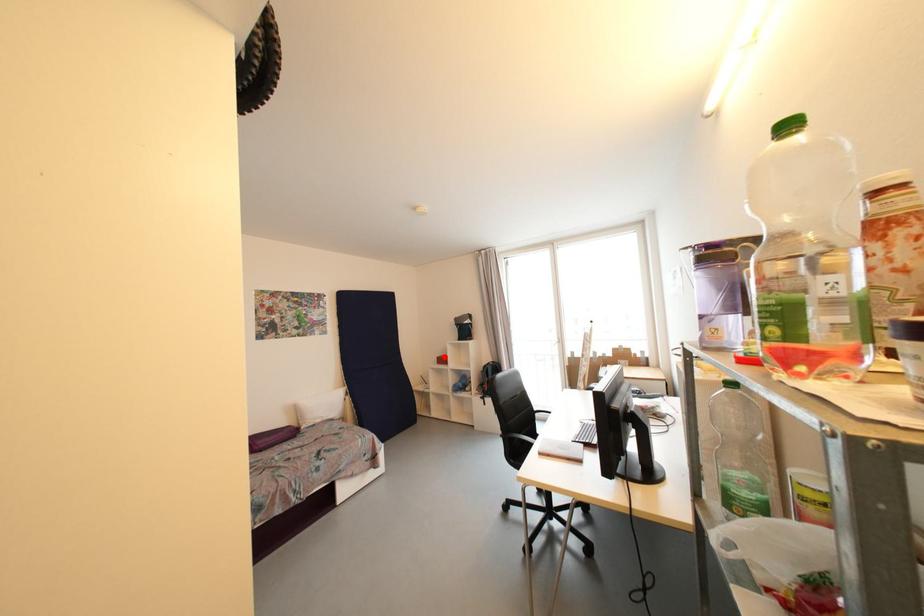
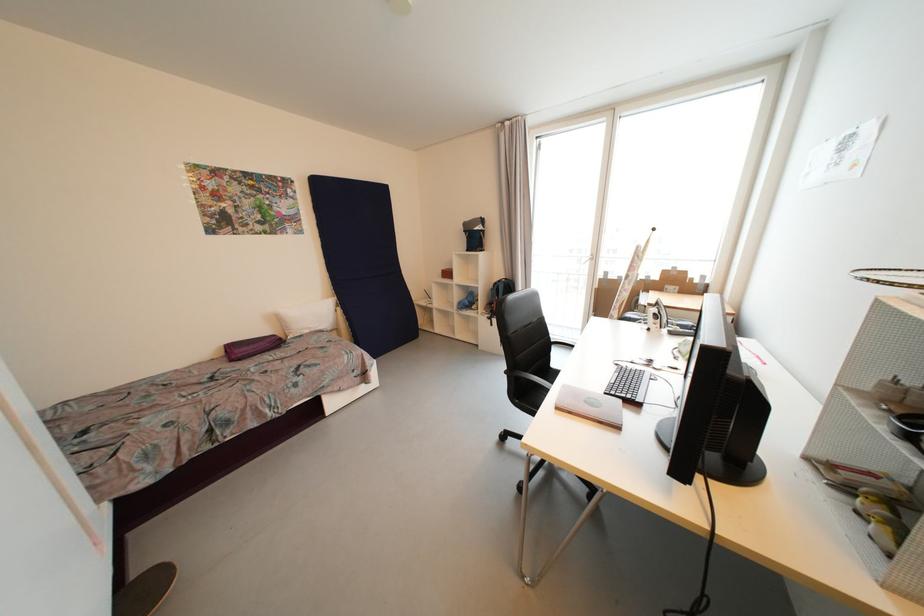
Find the pixel in the second image that matches the highlighted location in the first image.

(450, 270)